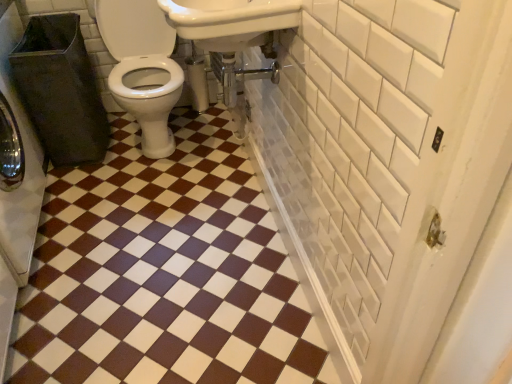
Question: In terms of size, does brown glossy tile at center appear bigger or smaller than white matte toilet paper at center?

Choices:
 (A) big
 (B) small

Answer: (A)

Question: From the image's perspective, is brown glossy tile at center above or below white matte toilet paper at center?

Choices:
 (A) above
 (B) below

Answer: (B)

Question: Which object is positioned farthest from the black plastic trash can at left?

Choices:
 (A) brown glossy tile at center
 (B) white matte toilet paper at center
 (C) white glossy sink at upper center

Answer: (B)

Question: Estimate the real-world distances between objects in this image. Which object is farther from the white glossy sink at upper center?

Choices:
 (A) brown glossy tile at center
 (B) white matte toilet paper at center
 (C) black plastic trash can at left

Answer: (C)